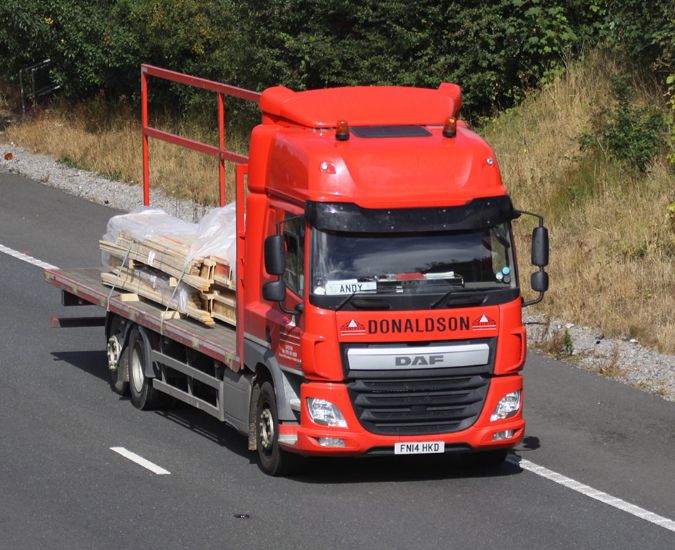
The image size is (675, 550). Identify the location of flat bed. (209, 335).